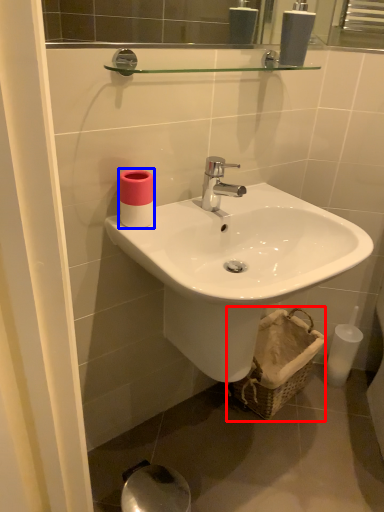
Question: Which point is closer to the camera, basket (highlighted by a red box) or toiletry (highlighted by a blue box)?

Choices:
 (A) basket
 (B) toiletry

Answer: (B)